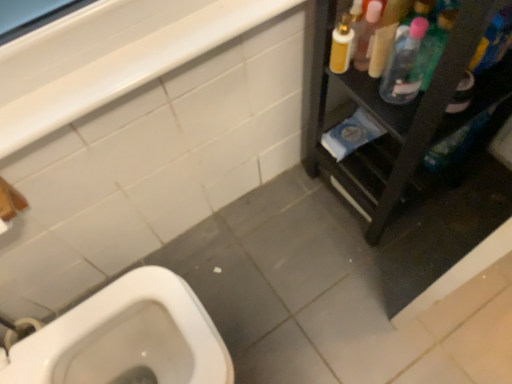
Question: Based on their sizes in the image, would you say white glossy balustrade at upper left is bigger or smaller than translucent plastic spray bottle at upper right, placed as the 2th cleaning product when sorted from left to right?

Choices:
 (A) small
 (B) big

Answer: (B)

Question: From a real-world perspective, is white glossy balustrade at upper left positioned above or below translucent plastic spray bottle at upper right, placed as the 2th cleaning product when sorted from left to right?

Choices:
 (A) above
 (B) below

Answer: (A)

Question: Estimate the real-world distances between objects in this image. Which object is closer to the white glossy balustrade at upper left?

Choices:
 (A) clear plastic bottle at upper right, placed as the first cleaning product when sorted from left to right
 (B) translucent plastic spray bottle at upper right, which is the first cleaning product from right to left
 (C) black plastic shelf at right

Answer: (A)

Question: Which of these objects is positioned farthest from the black plastic shelf at right?

Choices:
 (A) translucent plastic spray bottle at upper right, which is the first cleaning product from right to left
 (B) clear plastic bottle at upper right, placed as the first cleaning product when sorted from left to right
 (C) white glossy balustrade at upper left

Answer: (C)